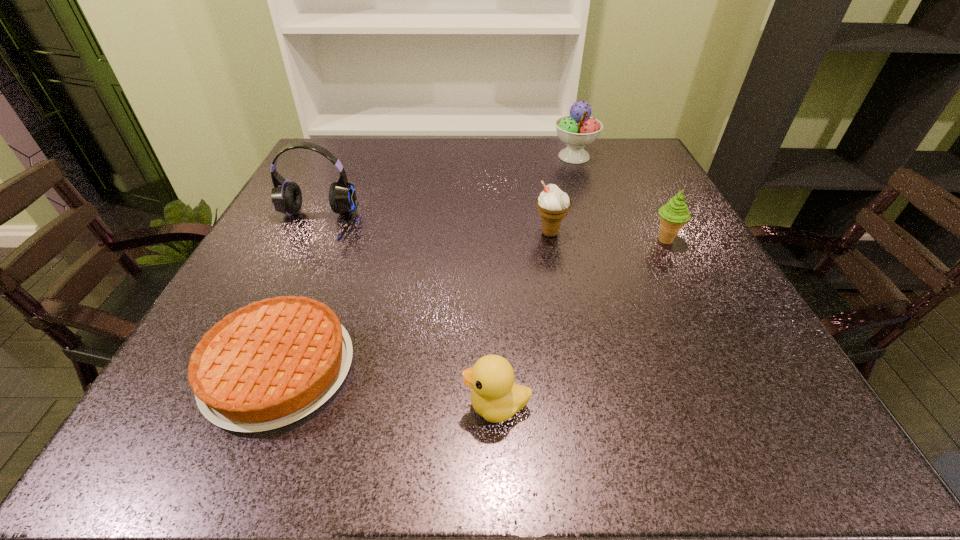
This screenshot has width=960, height=540. I want to click on headset, so click(286, 196).

Identify the location of the fifth object from left to right. (577, 130).

Where is `the second icecream from left to right`? The height and width of the screenshot is (540, 960). the second icecream from left to right is located at coordinates (577, 130).

At what (x,y) coordinates should I click in order to perform the action: click on the third object from right to left. Please return your answer as a coordinate pair (x, y). Image resolution: width=960 pixels, height=540 pixels. Looking at the image, I should click on (553, 204).

Where is `the rightmost object`? This screenshot has width=960, height=540. the rightmost object is located at coordinates (674, 213).

Where is `the second shortest object`? Image resolution: width=960 pixels, height=540 pixels. the second shortest object is located at coordinates (495, 396).

At what (x,y) coordinates should I click in order to perform the action: click on duck. Please return your answer as a coordinate pair (x, y). Looking at the image, I should click on (495, 396).

Where is `pie`? The height and width of the screenshot is (540, 960). pie is located at coordinates (271, 363).

At what (x,y) coordinates should I click in order to perform the action: click on vacant space located 0.370m on the ear cushions of the headset. Please return your answer as a coordinate pair (x, y). Looking at the image, I should click on (227, 411).

Where is `vacant area located on the front of the second object from right to left`? vacant area located on the front of the second object from right to left is located at coordinates (598, 228).